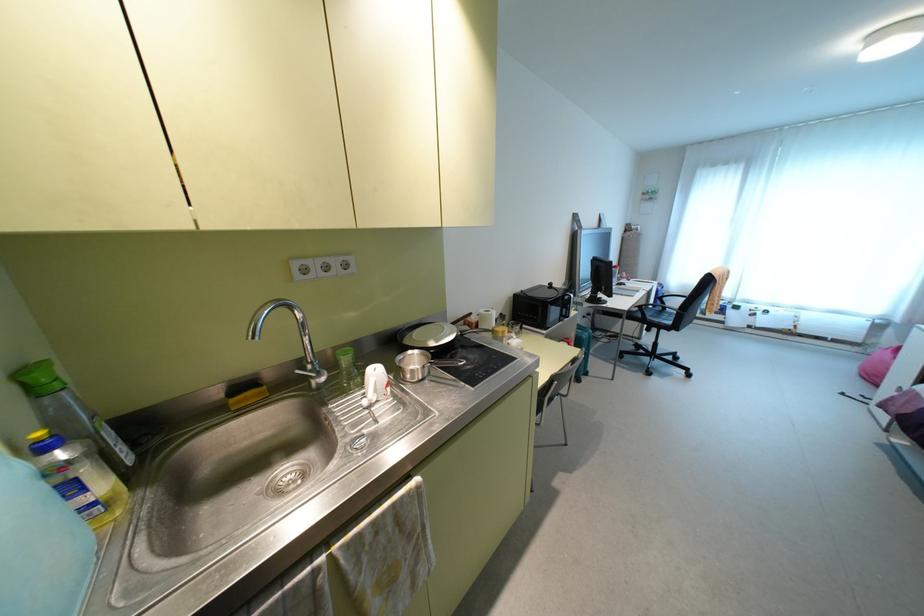
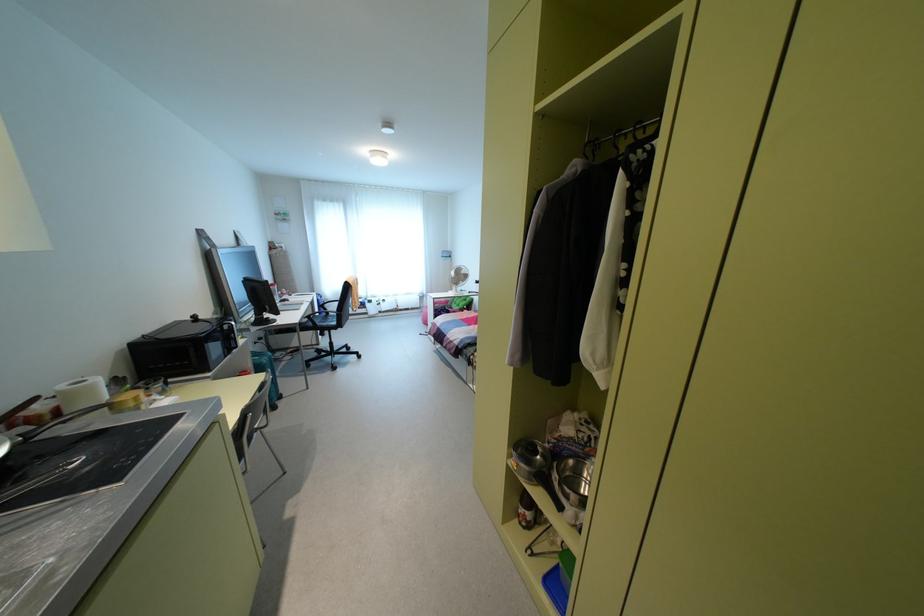
In the second image, find the point that corresponds to (x=638, y=306) in the first image.

(309, 315)